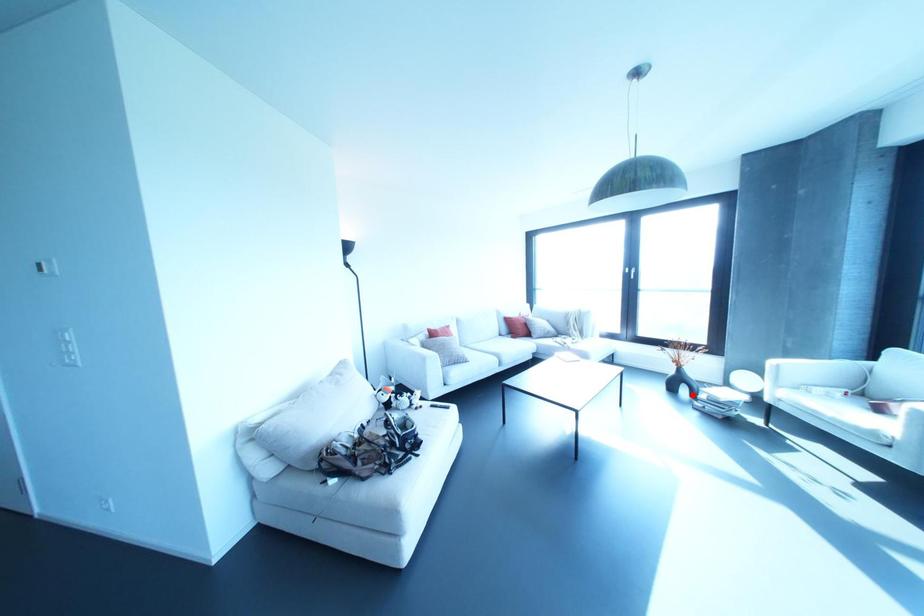
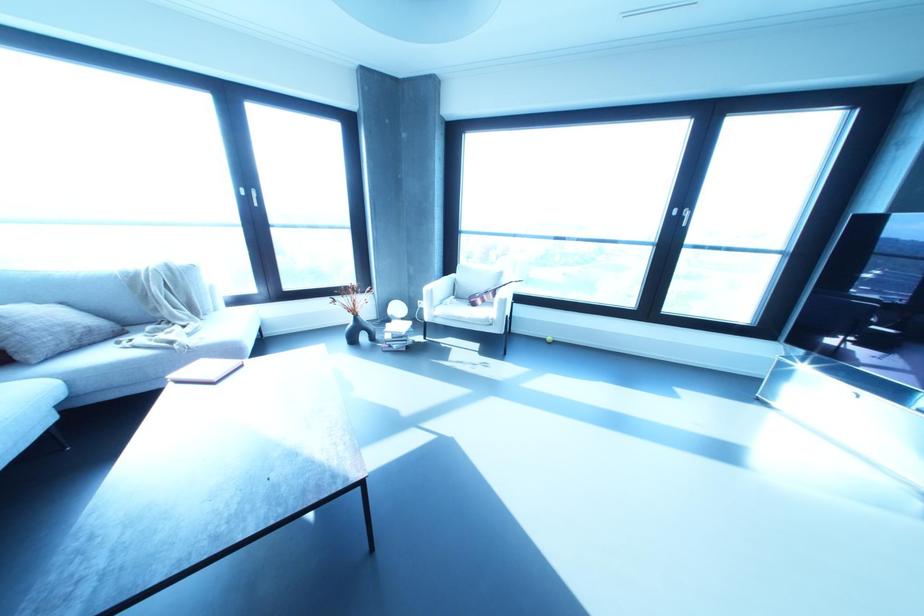
Question: I am providing you with two images of the same scene from different viewpoints. In image1, a red point is highlighted. Considering the same 3D point in image2, which of the following is correct?

Choices:
 (A) It is closer
 (B) It is farther

Answer: (B)